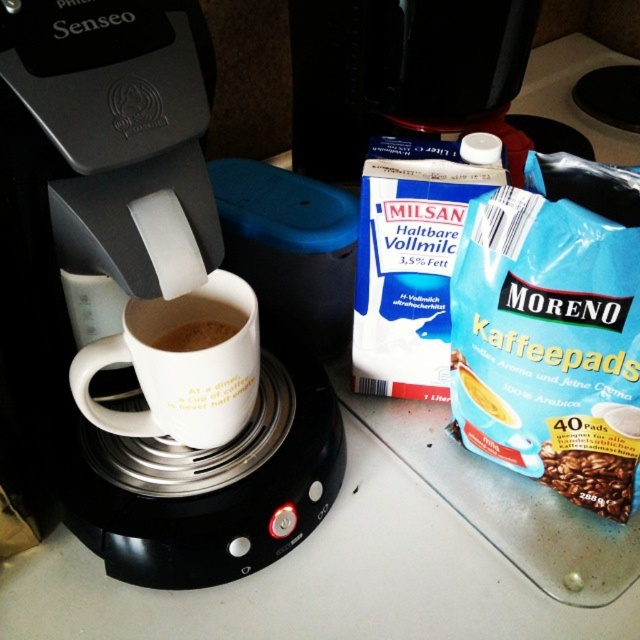
Is point (547, 465) positioned before point (216, 344)?

No, it is behind (216, 344).

The height and width of the screenshot is (640, 640). I want to click on brown matte coffee beans at lower right, so click(x=589, y=480).

Between black plastic coffee machine at center and black plastic coffee machine at upper center, which one appears on the right side from the viewer's perspective?

black plastic coffee machine at upper center is more to the right.

Does point (81, 81) come farther from viewer compared to point (291, 49)?

No.

Does point (243, 452) come behind point (534, 0)?

That is False.

Find the location of a particular element. black plastic coffee machine at center is located at coordinates [140, 294].

Who is higher up, black plastic coffee machine at upper center or white matte mug at center?

black plastic coffee machine at upper center

How much distance is there between black plastic coffee machine at upper center and white matte mug at center?

15.17 inches

Describe the element at coordinates (403, 74) in the screenshot. I see `black plastic coffee machine at upper center` at that location.

The height and width of the screenshot is (640, 640). I want to click on black plastic coffee machine at upper center, so click(403, 74).